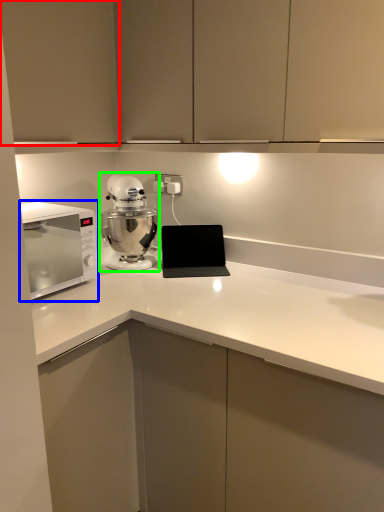
Question: Which object is the closest to the cabinetry (highlighted by a red box)? Choose among these: home appliance (highlighted by a blue box) or mixer (highlighted by a green box).

Choices:
 (A) home appliance
 (B) mixer

Answer: (A)